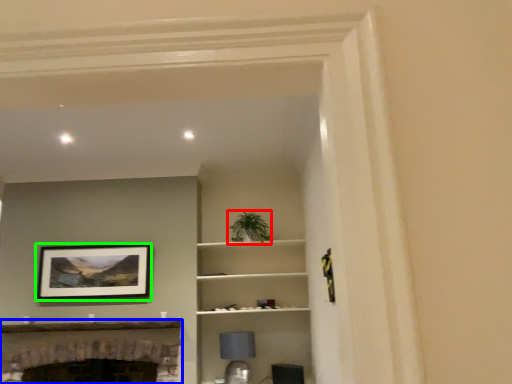
Question: Considering the real-world distances, which object is farthest from plant (highlighted by a red box)? fireplace (highlighted by a blue box) or picture frame (highlighted by a green box)?

Choices:
 (A) fireplace
 (B) picture frame

Answer: (A)